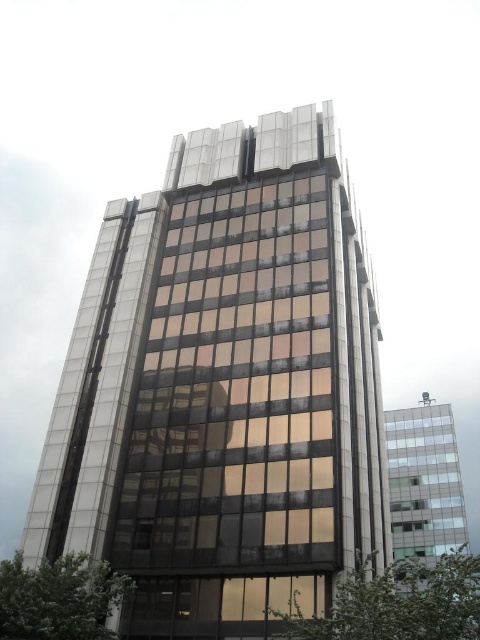
You are an architect examining the building designs. You notice the glassy reflective building at center and the clear glass building at right. Which one is positioned higher in the image?

The glassy reflective building at center is located above the clear glass building at right, so it is positioned higher in the image.

You are an architect analyzing two buildings in the image. The glassy reflective building at center and the clear glass building at right. Which one has a smaller width according to the description?

The glassy reflective building at center has a smaller width than the clear glass building at right.

You are standing in front of a tall modern building with a crown structure at the top. You notice a point marked at coordinates (224,388). Based on the scene description, what does this point most likely represent?

The point at (224,388) most likely represents the glassy reflective building at center, as the description states that this building is represented by that coordinate.